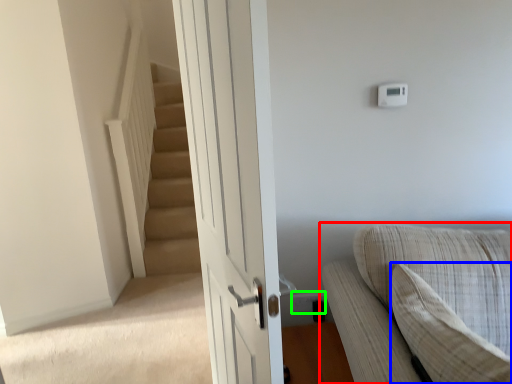
Question: Which is farther away from studio couch (highlighted by a red box)? pillow (highlighted by a blue box) or electric outlet (highlighted by a green box)?

Choices:
 (A) pillow
 (B) electric outlet

Answer: (B)